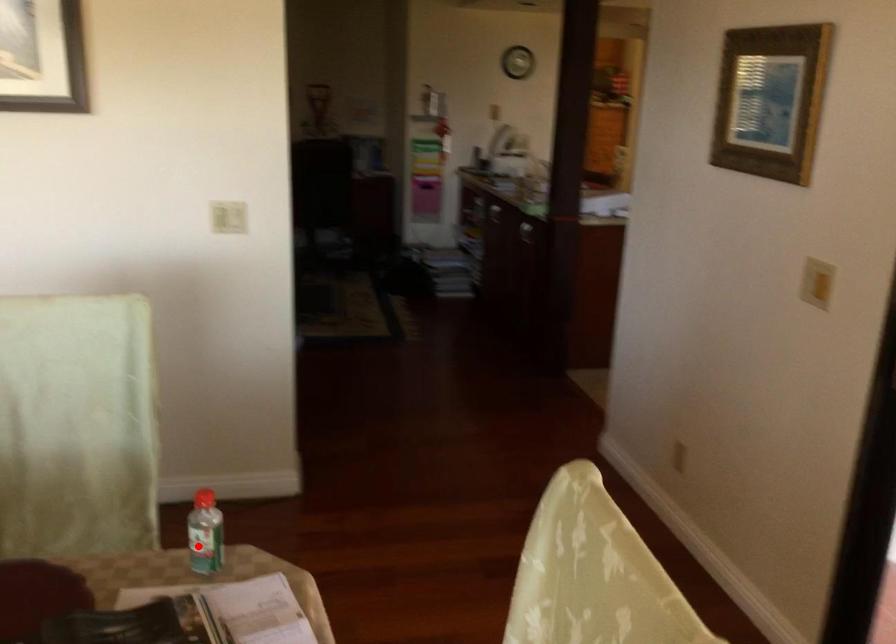
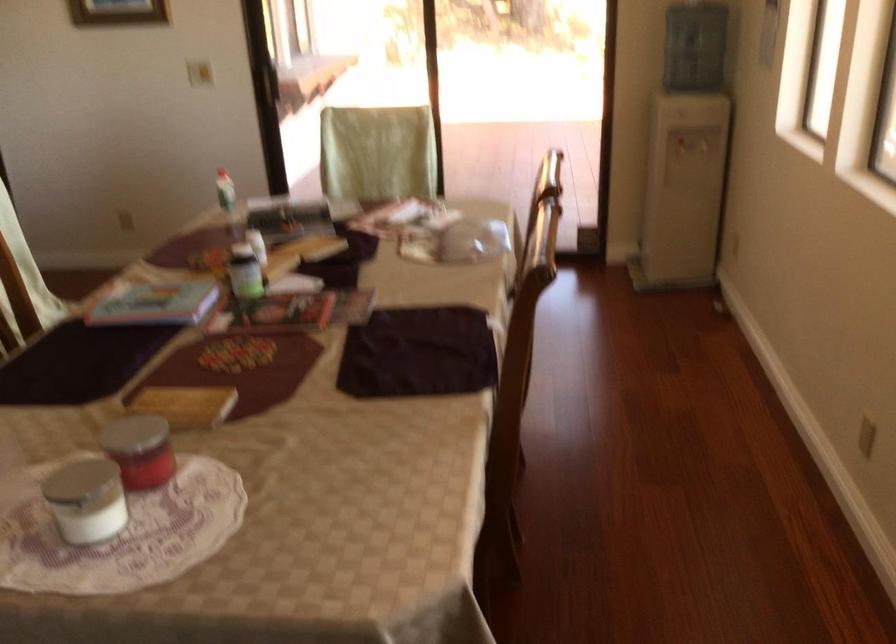
In the second image, find the point that corresponds to the highlighted location in the first image.

(225, 190)